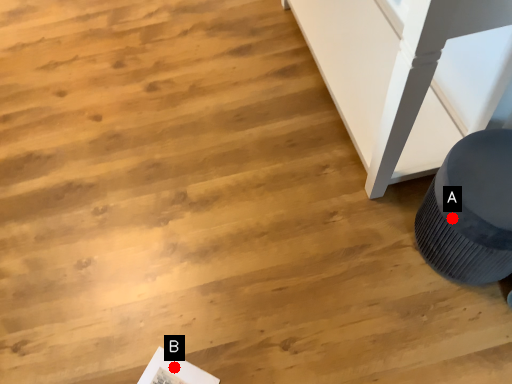
Question: Two points are circled on the image, labeled by A and B beside each circle. Which point is closer to the camera?

Choices:
 (A) A is closer
 (B) B is closer

Answer: (A)